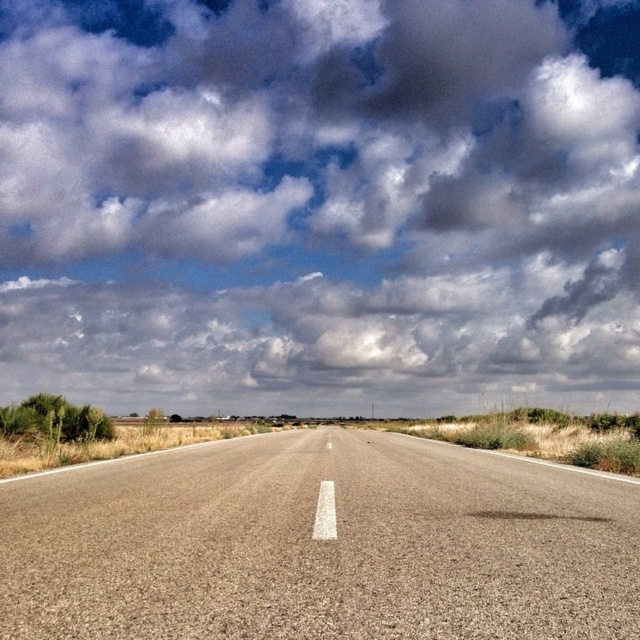
Question: Is cloudy sky at upper center bigger than asphalt road at center?

Choices:
 (A) yes
 (B) no

Answer: (A)

Question: Which of the following is the farthest from the observer?

Choices:
 (A) (449, 280)
 (B) (241, 497)

Answer: (A)

Question: Can you confirm if cloudy sky at upper center is smaller than asphalt road at center?

Choices:
 (A) no
 (B) yes

Answer: (A)

Question: Which point is farther to the camera?

Choices:
 (A) [x=529, y=268]
 (B) [x=106, y=545]

Answer: (A)

Question: Does cloudy sky at upper center come behind asphalt road at center?

Choices:
 (A) no
 (B) yes

Answer: (B)